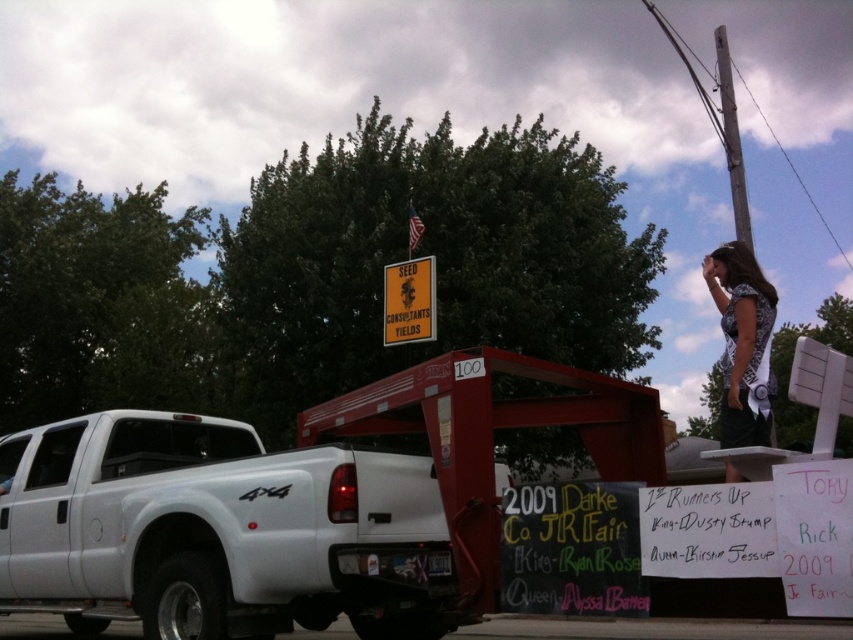
You are a photographer trying to capture a clear shot of both the printed fabric blouse at right and the gray wooden pole at upper right. Which object should you adjust your camera to focus on first to ensure both are in frame?

You should focus on the printed fabric blouse at right first since it is positioned to the left of the gray wooden pole at upper right, allowing you to frame both objects by adjusting the camera from left to right.

What is the spatial relationship between the printed fabric blouse at right and the yellow paper sign at center in the image?

The printed fabric blouse at right is in front of the yellow paper sign at center.